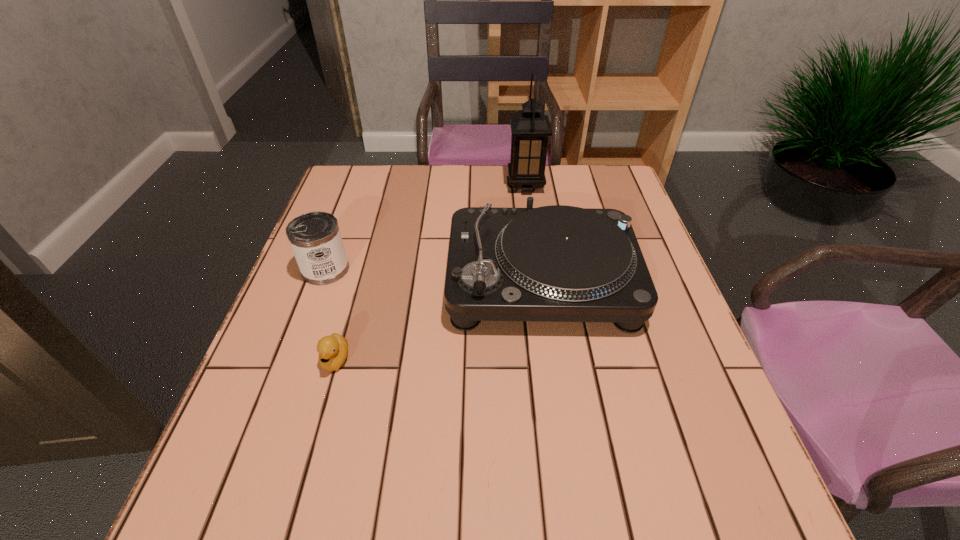
Where is `object that is positioned at the far edge`? This screenshot has width=960, height=540. object that is positioned at the far edge is located at coordinates (530, 127).

Locate an element on the screen. This screenshot has height=540, width=960. can that is at the left edge is located at coordinates (315, 238).

Locate an element on the screen. The image size is (960, 540). duckling located at the left edge is located at coordinates (333, 349).

At what (x,y) coordinates should I click in order to perform the action: click on object situated at the right edge. Please return your answer as a coordinate pair (x, y). This screenshot has height=540, width=960. Looking at the image, I should click on (557, 263).

In the image, there is a desktop. At what (x,y) coordinates should I click in order to perform the action: click on vacant region at the far edge. Please return your answer as a coordinate pair (x, y). Looking at the image, I should click on pyautogui.click(x=476, y=168).

In the image, there is a desktop. At what (x,y) coordinates should I click in order to perform the action: click on vacant space at the left edge. Please return your answer as a coordinate pair (x, y). The height and width of the screenshot is (540, 960). Looking at the image, I should click on (324, 388).

Identify the location of vacant area at the right edge of the desktop. (640, 415).

Identify the location of free space at the far left corner of the desktop. This screenshot has height=540, width=960. (383, 176).

Locate an element on the screen. vacant space at the far right corner of the desktop is located at coordinates (584, 192).

Image resolution: width=960 pixels, height=540 pixels. What are the coordinates of `unoccupied position between the duckling and the can` in the screenshot? It's located at (330, 314).